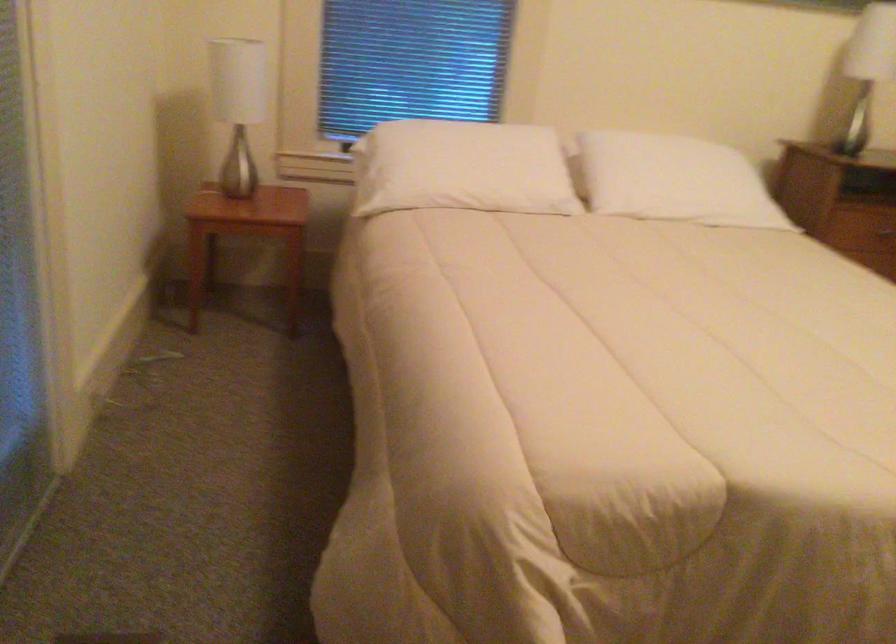
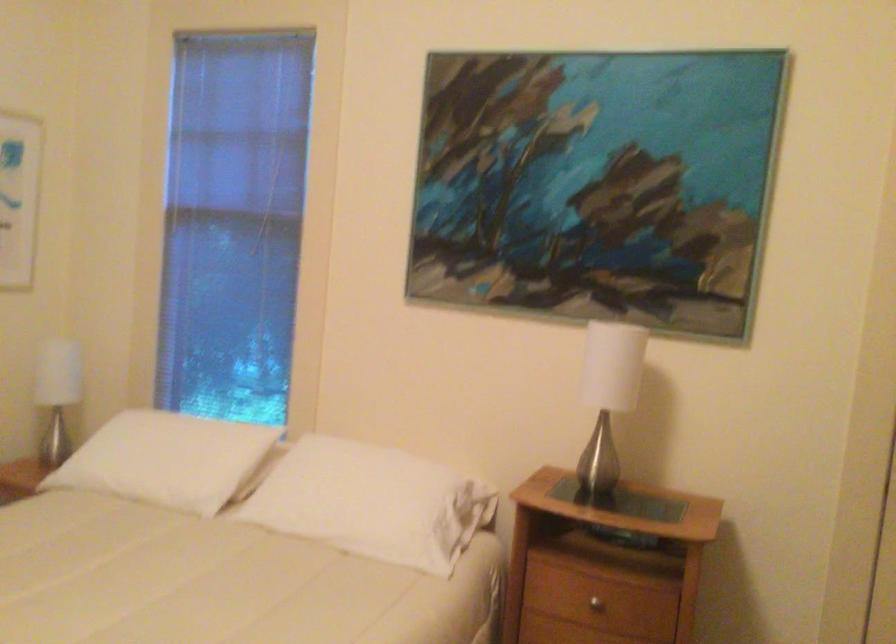
Find the pixel in the second image that matches point (710, 167) in the first image.

(373, 502)